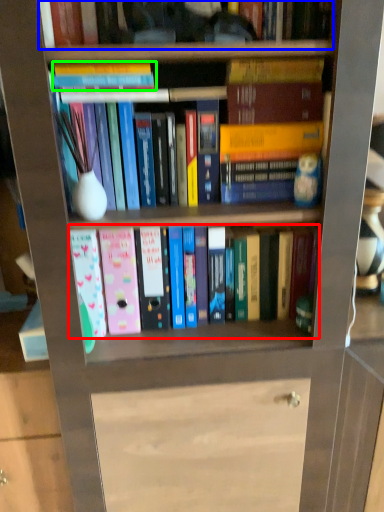
Question: Estimate the real-world distances between objects in this image. Which object is closer to book (highlighted by a red box), book (highlighted by a blue box) or book (highlighted by a green box)?

Choices:
 (A) book
 (B) book

Answer: (B)